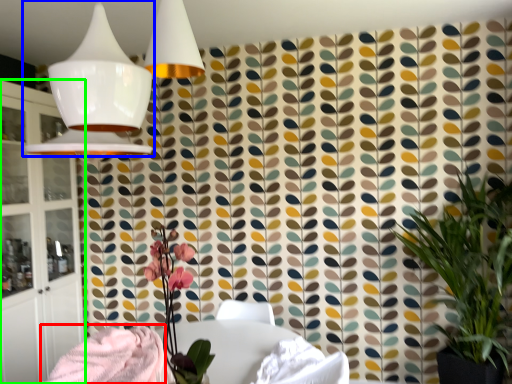
Question: Estimate the real-world distances between objects in this image. Which object is closer to blanket (highlighted by a red box), lamp (highlighted by a blue box) or cabinetry (highlighted by a green box)?

Choices:
 (A) lamp
 (B) cabinetry

Answer: (A)